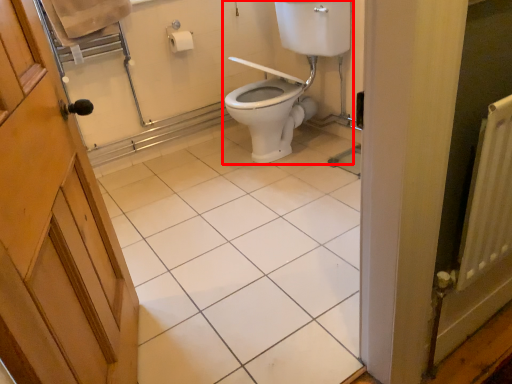
Question: From the image's perspective, what is the correct spatial relationship of sink (annotated by the red box) in relation to tile?

Choices:
 (A) below
 (B) above

Answer: (B)